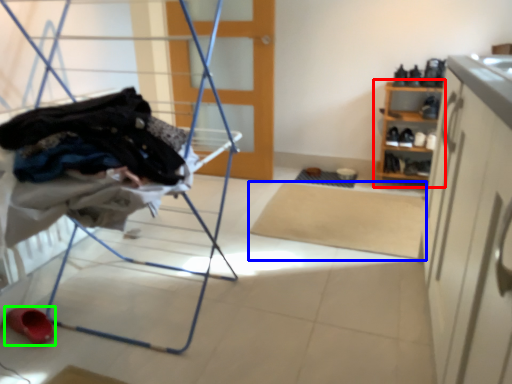
Question: Estimate the real-world distances between objects in this image. Which object is farther from shelf (highlighted by a red box), mat (highlighted by a blue box) or footwear (highlighted by a green box)?

Choices:
 (A) mat
 (B) footwear

Answer: (B)